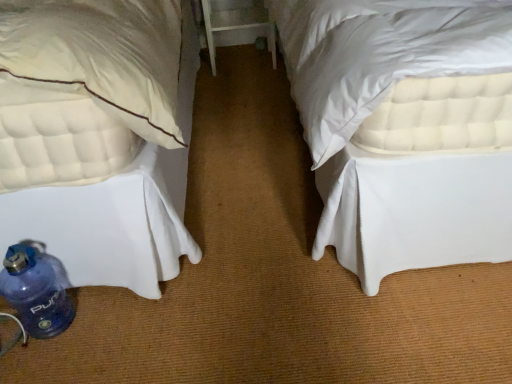
You are a GUI agent. You are given a task and a screenshot of the screen. Output one action in this format:
    pyautogui.click(x=<x>, y=<y>)
    Task: Click on the vacant space in front of blue plastic water bottle at lower left
    The image size is (512, 384).
    Given the screenshot: What is the action you would take?
    pyautogui.click(x=39, y=360)